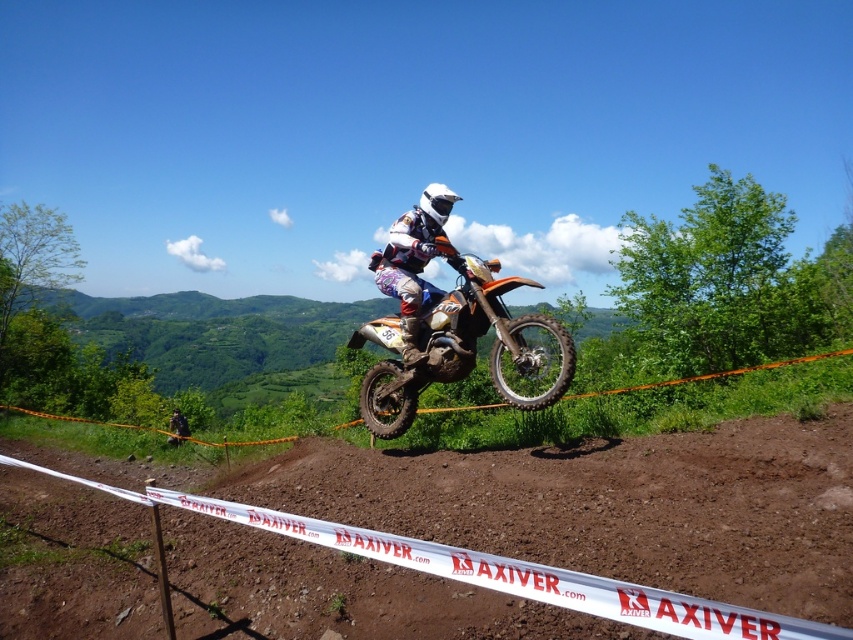
Question: Is brown dirt field at center positioned at the back of white matte helmet at center?

Choices:
 (A) yes
 (B) no

Answer: (B)

Question: Which of the following is the closest to the observer?

Choices:
 (A) (374, 262)
 (B) (566, 339)
 (C) (804, 445)

Answer: (C)

Question: Which of the following is the farthest from the observer?

Choices:
 (A) orange matte dirt bike at center
 (B) brown dirt field at center

Answer: (A)

Question: Does orange matte dirt bike at center have a larger size compared to white matte helmet at center?

Choices:
 (A) no
 (B) yes

Answer: (B)

Question: In this image, where is brown dirt field at center located relative to white matte helmet at center?

Choices:
 (A) right
 (B) left

Answer: (A)

Question: Which of these objects is positioned closest to the white matte helmet at center?

Choices:
 (A) orange matte dirt bike at center
 (B) brown dirt field at center

Answer: (A)